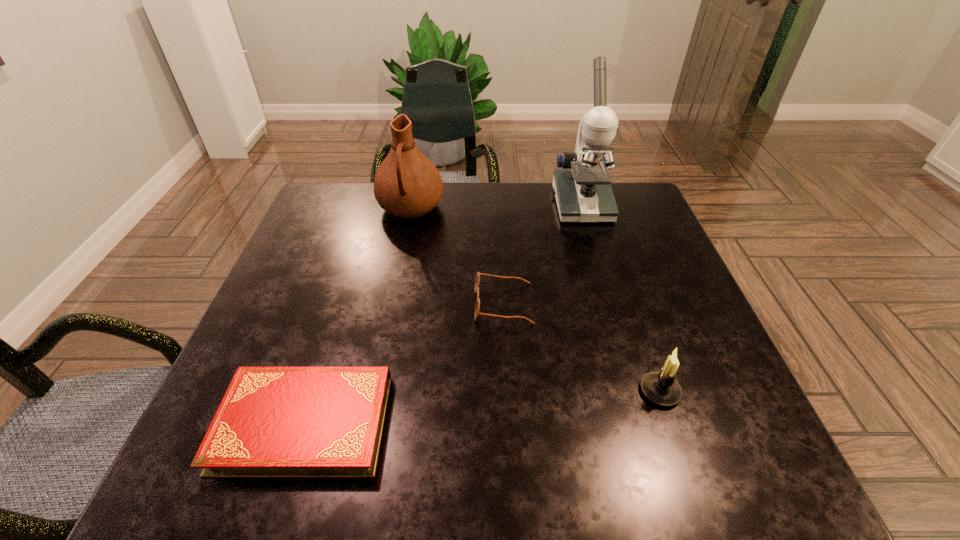
This screenshot has height=540, width=960. I want to click on vacant region located on the front-facing side of the spectacles, so [323, 304].

At what (x,y) coordinates should I click in order to perform the action: click on vacant space positioned on the front-facing side of the spectacles. Please return your answer as a coordinate pair (x, y). This screenshot has width=960, height=540. Looking at the image, I should click on (304, 304).

Where is `free spot located on the cover of the shortest object`? The image size is (960, 540). free spot located on the cover of the shortest object is located at coordinates (446, 423).

You are a GUI agent. You are given a task and a screenshot of the screen. Output one action in this format:
    pyautogui.click(x=<x>, y=<y>)
    Task: Click on the microscope that is at the far edge
    The image size is (960, 540).
    Given the screenshot: What is the action you would take?
    pyautogui.click(x=583, y=192)

Find the location of a particular element. This screenshot has height=540, width=960. pitcher at the far edge is located at coordinates (407, 184).

Identify the location of object that is positioned at the near edge. (273, 422).

Identify the location of object at the left edge. (273, 422).

At what (x,y) coordinates should I click in order to perform the action: click on microscope that is at the right edge. Please return your answer as a coordinate pair (x, y). The width and height of the screenshot is (960, 540). Looking at the image, I should click on (583, 192).

Where is `candle holder positioned at the right edge`? candle holder positioned at the right edge is located at coordinates (660, 387).

The image size is (960, 540). In order to click on object present at the near left corner in this screenshot , I will do `click(273, 422)`.